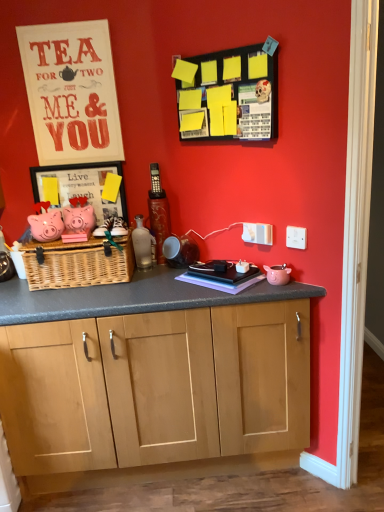
Locate an element on the screen. The image size is (384, 512). vacant space situated above purple matte book at center (from a real-world perspective) is located at coordinates (223, 263).